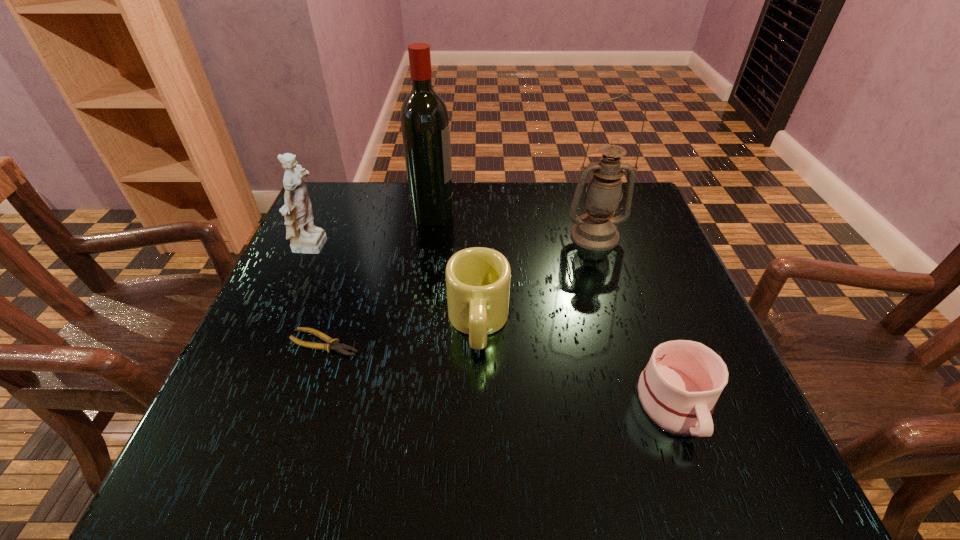
The width and height of the screenshot is (960, 540). I want to click on object at the far right corner, so click(x=596, y=230).

Locate an element on the screen. This screenshot has height=540, width=960. object present at the near right corner is located at coordinates (678, 389).

What are the coordinates of `free space at the far edge` in the screenshot? It's located at (514, 188).

The height and width of the screenshot is (540, 960). Find the location of `vacant area at the near edge`. vacant area at the near edge is located at coordinates (494, 448).

The width and height of the screenshot is (960, 540). In the image, there is a desktop. In order to click on blank space at the left edge in this screenshot , I will do `click(243, 394)`.

I want to click on vacant space at the right edge, so click(x=639, y=337).

Locate an element on the screen. This screenshot has width=960, height=540. blank space at the far left corner of the desktop is located at coordinates (336, 184).

Where is `free space at the near left corner`? Image resolution: width=960 pixels, height=540 pixels. free space at the near left corner is located at coordinates (229, 474).

I want to click on empty space between the fourth object from right to left and the second tallest object, so click(x=514, y=225).

Where is `vacant area that lies between the fourth tallest object and the oil lamp`? vacant area that lies between the fourth tallest object and the oil lamp is located at coordinates (537, 279).